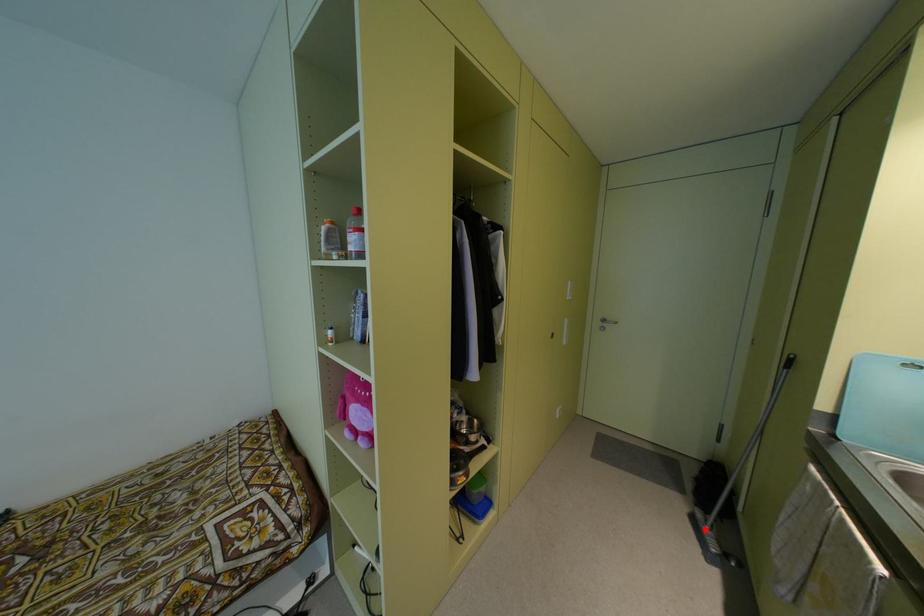
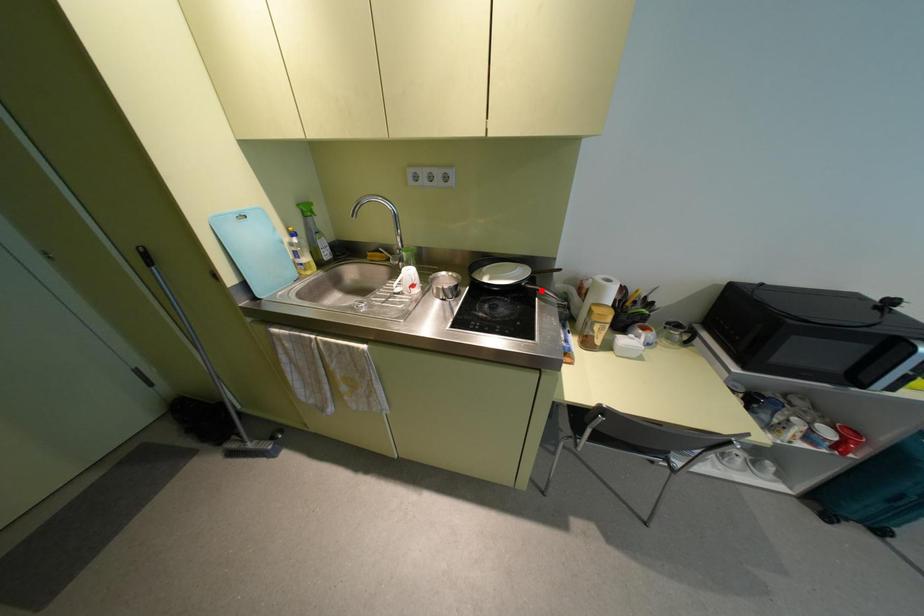
I am providing you with two images of the same scene from different viewpoints. A red point is marked on the first image and another point is marked on the second image. Does the point marked in image1 correspond to the same location as the one in image2?

No